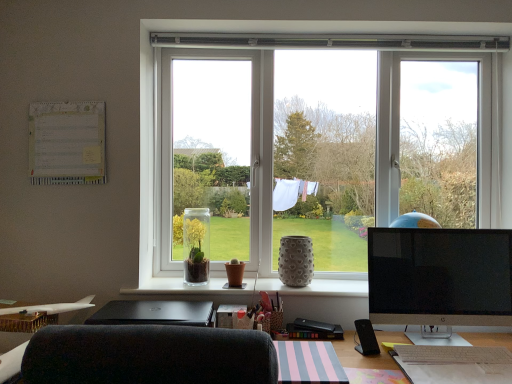
Question: Does white paperboard at upper left have a larger size compared to gray textured vase at center, which is the third vase in left-to-right order?

Choices:
 (A) no
 (B) yes

Answer: (A)

Question: Does white paperboard at upper left have a greater width compared to gray textured vase at center, which is the third vase in left-to-right order?

Choices:
 (A) no
 (B) yes

Answer: (A)

Question: Does white paperboard at upper left appear on the right side of gray textured vase at center, which is the 1th vase from right to left?

Choices:
 (A) no
 (B) yes

Answer: (A)

Question: From the image's perspective, is white paperboard at upper left located beneath gray textured vase at center, which is the third vase in left-to-right order?

Choices:
 (A) no
 (B) yes

Answer: (A)

Question: Considering the relative sizes of white paperboard at upper left and gray textured vase at center, which is the third vase in left-to-right order, in the image provided, is white paperboard at upper left smaller than gray textured vase at center, which is the third vase in left-to-right order,?

Choices:
 (A) yes
 (B) no

Answer: (A)

Question: From a real-world perspective, is white paperboard at upper left positioned over gray textured vase at center, which is the 1th vase from right to left, based on gravity?

Choices:
 (A) yes
 (B) no

Answer: (A)

Question: Considering the relative positions of gray textured vase at center, which is the 1th vase from right to left, and black glossy monitor at right in the image provided, is gray textured vase at center, which is the 1th vase from right to left, behind black glossy monitor at right?

Choices:
 (A) no
 (B) yes

Answer: (B)

Question: Is gray textured vase at center, which is the third vase in left-to-right order, bigger than black glossy monitor at right?

Choices:
 (A) no
 (B) yes

Answer: (A)

Question: From a real-world perspective, is gray textured vase at center, which is the 1th vase from right to left, positioned over black glossy monitor at right based on gravity?

Choices:
 (A) yes
 (B) no

Answer: (A)

Question: Is gray textured vase at center, which is the 1th vase from right to left, looking in the opposite direction of black glossy monitor at right?

Choices:
 (A) no
 (B) yes

Answer: (A)

Question: Are gray textured vase at center, which is the 1th vase from right to left, and black glossy monitor at right located far from each other?

Choices:
 (A) no
 (B) yes

Answer: (A)

Question: Considering the relative sizes of gray textured vase at center, which is the 1th vase from right to left, and black glossy monitor at right in the image provided, is gray textured vase at center, which is the 1th vase from right to left, thinner than black glossy monitor at right?

Choices:
 (A) yes
 (B) no

Answer: (B)

Question: Considering the relative positions of clear glass vase at center, the 3th vase positioned from the right, and white textured vase at center in the image provided, is clear glass vase at center, the 3th vase positioned from the right, to the right of white textured vase at center from the viewer's perspective?

Choices:
 (A) yes
 (B) no

Answer: (B)